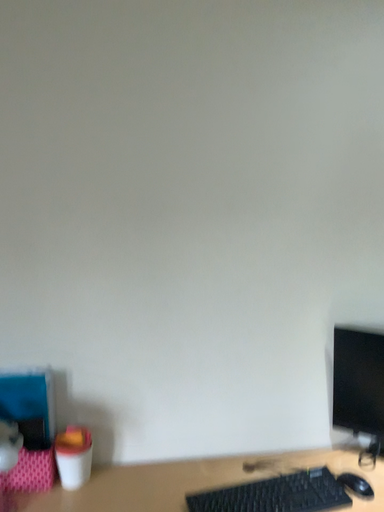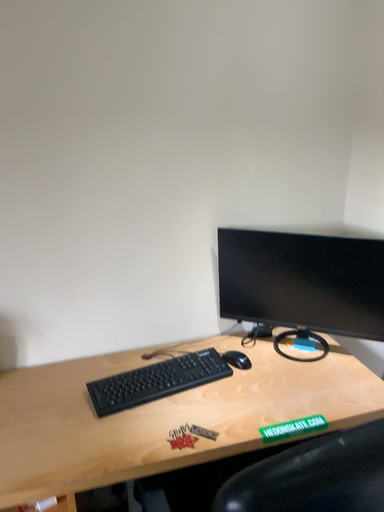
Question: How did the camera likely rotate when shooting the video?

Choices:
 (A) rotated downward
 (B) rotated upward

Answer: (A)